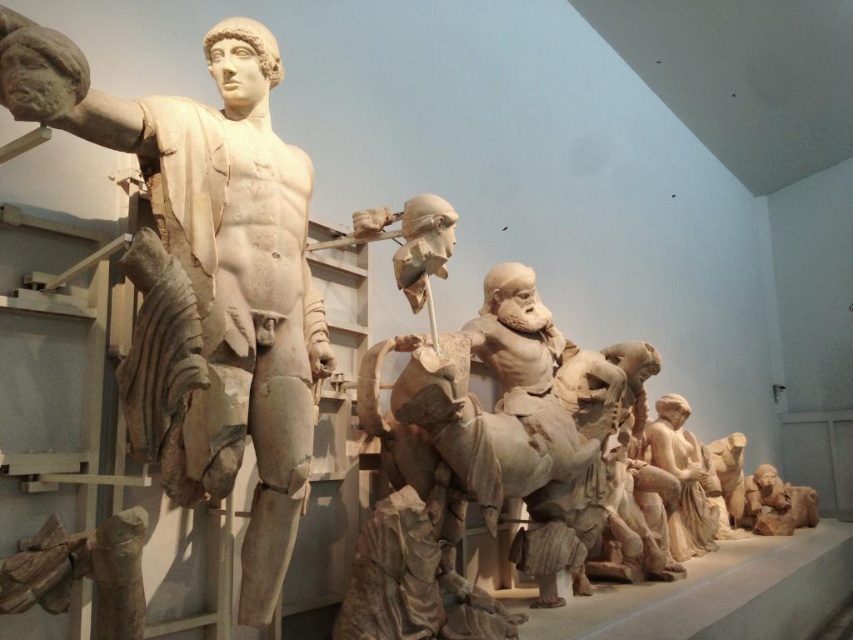
You are a tour guide leading a group through the museum. You want to ensure visitors can comfortably walk between the white marble statue at left and the smooth beige statue at lower right. The path between them is 3.45 meters wide. If a visitor is using a wheelchair that requires a minimum of 1.2 meters of clearance, is the path wide enough?

The path between the white marble statue at left and the smooth beige statue at lower right is 3.45 meters wide, which exceeds the required 1.2 meters of clearance. Therefore, the path is wide enough for a wheelchair to pass comfortably.

In the scene shown: You are an art curator planning to move the white marble statue at left and the smooth beige statue at lower right to a new exhibition space. The entrance to the new space has a doorway that is 1.8 meters wide. Can both statues pass through the doorway if moved individually?

The white marble statue at left is wider than the smooth beige statue at lower right. Since the doorway is 1.8 meters wide, both statues can pass through individually as long as their widths are less than 1.8 meters. However, the exact widths are not provided, so we cannot confirm without additional measurements.

You are an art student observing the ancient Greek sculptures in the museum. You notice the white marble statue at left and the smooth beige statue at lower right. Which statue is positioned higher relative to the other?

The white marble statue at left is positioned higher than the smooth beige statue at lower right.